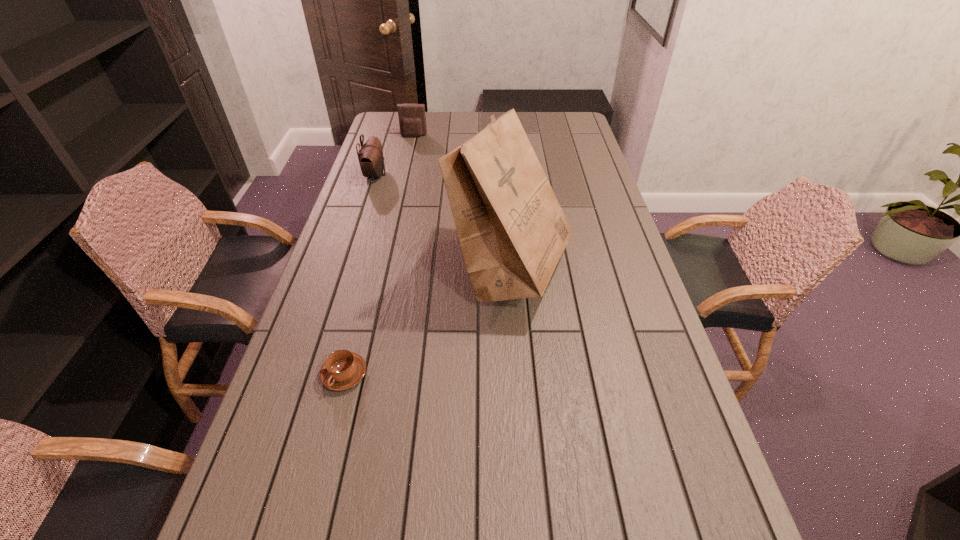
At what (x,y) coordinates should I click in order to perform the action: click on free location that satisfies the following two spatial constraints: 1. with an open flap on the farther pouch; 2. on the left side of the grocery bag. Please return your answer as a coordinate pair (x, y). Looking at the image, I should click on (383, 269).

You are a GUI agent. You are given a task and a screenshot of the screen. Output one action in this format:
    pyautogui.click(x=<x>, y=<y>)
    Task: Click on the vacant area that satisfies the following two spatial constraints: 1. with an open flap on the farther pouch; 2. on the left side of the second nearest object
    
    Given the screenshot: What is the action you would take?
    pyautogui.click(x=383, y=269)

In order to click on vacant point that satisfies the following two spatial constraints: 1. with an open flap on the right pouch; 2. with the flap open on the nearer pouch in this screenshot , I will do `click(405, 175)`.